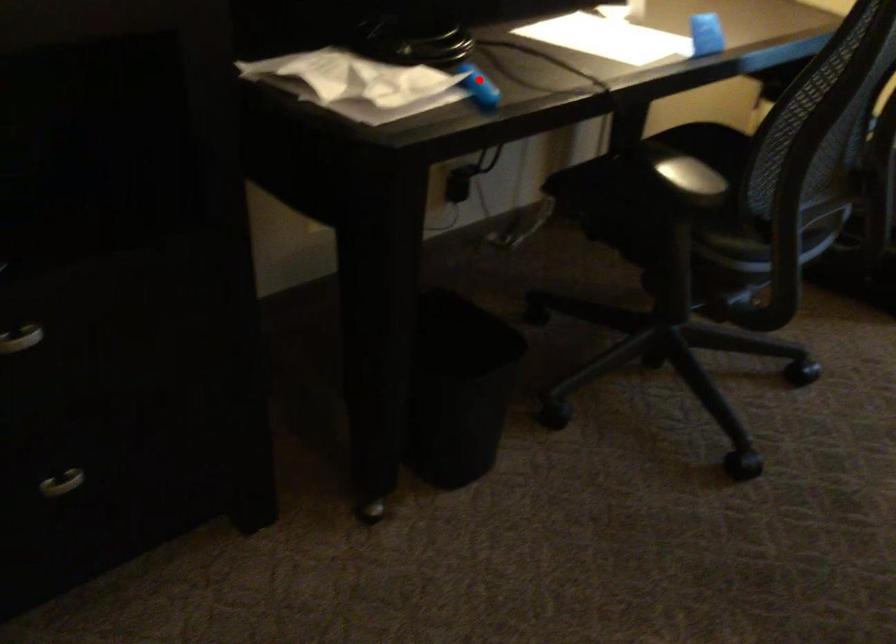
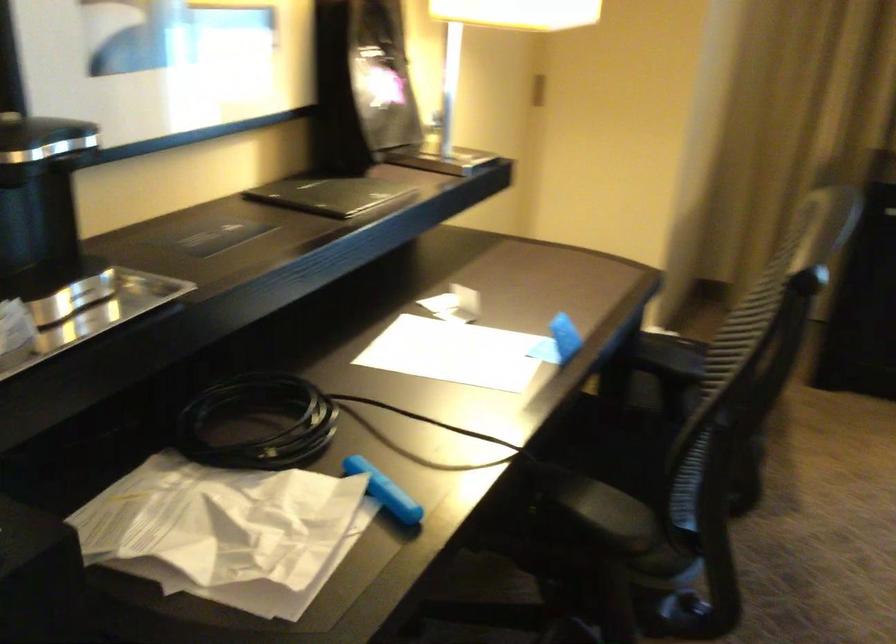
The point at the highlighted location is marked in the first image. Where is the corresponding point in the second image?

(384, 491)